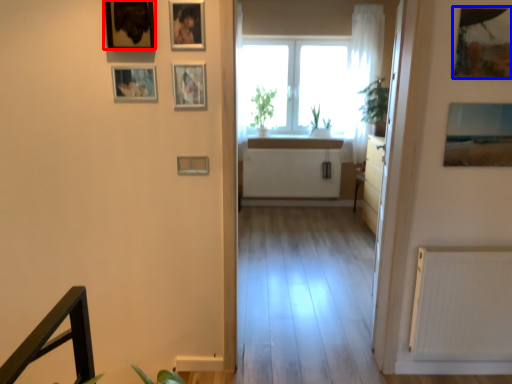
Question: Which object appears closest to the camera in this image, picture frame (highlighted by a red box) or picture frame (highlighted by a blue box)?

Choices:
 (A) picture frame
 (B) picture frame

Answer: (A)